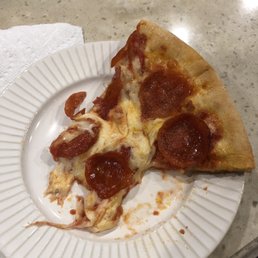
Locate an element on the screen. plate is located at coordinates (80, 61).